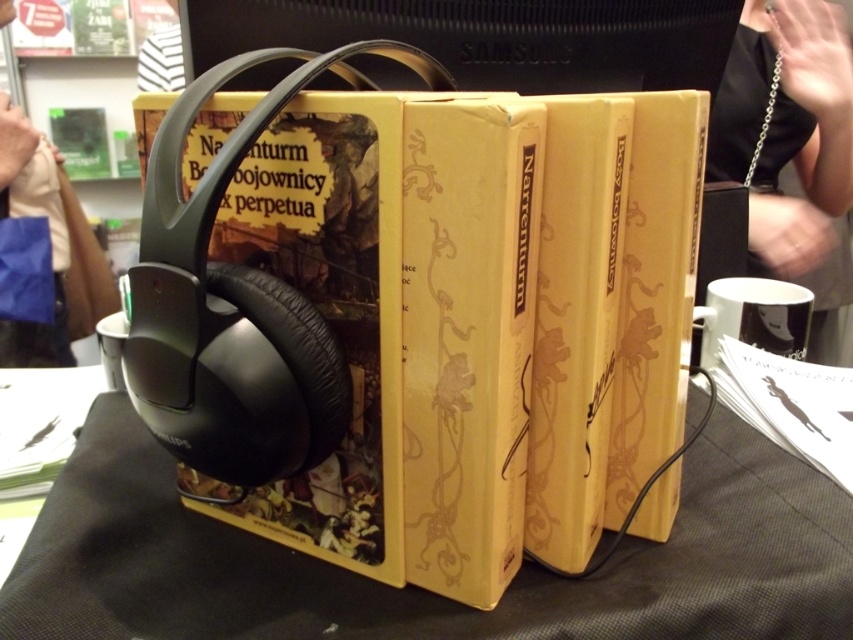
You are organizing items on a table and need to place a new item between the yellow paperback book at center and the black leather handbag at upper right. Based on their positions, where should you place the new item?

Since the yellow paperback book at center is to the left of the black leather handbag at upper right, you should place the new item between them to the right of the yellow paperback book at center and to the left of the black leather handbag at upper right.

Looking at this image, you are organizing a library and need to place a small decorative item on the yellow paperback book at center. However, the item must not hang over the edges of the book. Given that the book is placed on the black matte table at center, can you confirm if the item will fit entirely on the book without overhanging?

The yellow paperback book at center is above the black matte table at center, so the book is resting on the table. Since the item must not hang over the edges, you need to ensure the item is smaller than the book itself. However, without knowing the exact dimensions of the book or the item, it is impossible to confirm if the item will fit entirely without overhanging.

You are a delivery person who needs to place a package between the two points marked as point (256, 515). The package is 16 inches long. Will it fit between them?

The distance between the two points marked as point (256, 515) is 17.15 inches. Since the package is 16 inches long, it will fit between them as there is enough space.